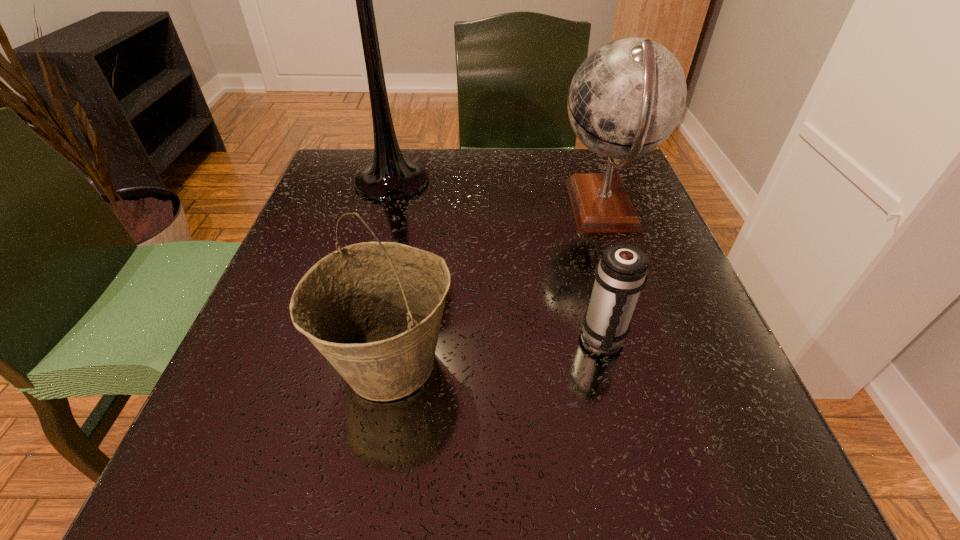
Locate an element on the screen. free space between the table lamp and the third shortest object is located at coordinates (497, 194).

Locate an element on the screen. This screenshot has height=540, width=960. vacant region between the globe and the tallest object is located at coordinates [x=497, y=194].

You are a GUI agent. You are given a task and a screenshot of the screen. Output one action in this format:
    pyautogui.click(x=<x>, y=<y>)
    Task: Click on the vacant space in between the second shortest object and the second tallest object
    The height and width of the screenshot is (540, 960).
    Given the screenshot: What is the action you would take?
    (x=496, y=286)

Image resolution: width=960 pixels, height=540 pixels. What are the coordinates of `the second closest object to the shortest object` in the screenshot? It's located at (373, 309).

Locate which object is the second closest to the tallest object. Please provide its 2D coordinates. Your answer should be formatted as a tuple, i.e. [(x, y)], where the tuple contains the x and y coordinates of a point satisfying the conditions above.

[(373, 309)]

Where is `vacant region that satisfies the following two spatial constraints: 1. at the equator of the third shortest object; 2. on the side with the handle of the thermos bottle`? The image size is (960, 540). vacant region that satisfies the following two spatial constraints: 1. at the equator of the third shortest object; 2. on the side with the handle of the thermos bottle is located at coordinates (647, 336).

In order to click on free location that satisfies the following two spatial constraints: 1. on the front side of the tallest object; 2. on the right side of the second shortest object in this screenshot , I will do `click(343, 363)`.